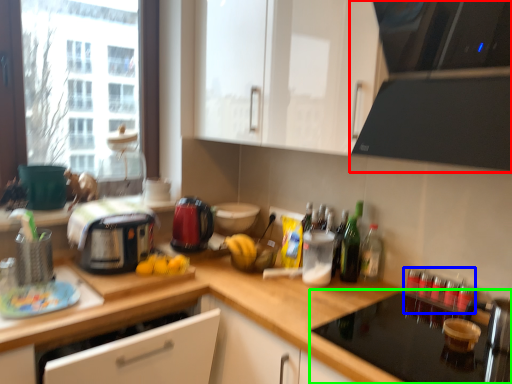
Question: Which is nearer to the home appliance (highlighted by a red box)? bottle (highlighted by a blue box) or appliance (highlighted by a green box).

Choices:
 (A) bottle
 (B) appliance

Answer: (B)